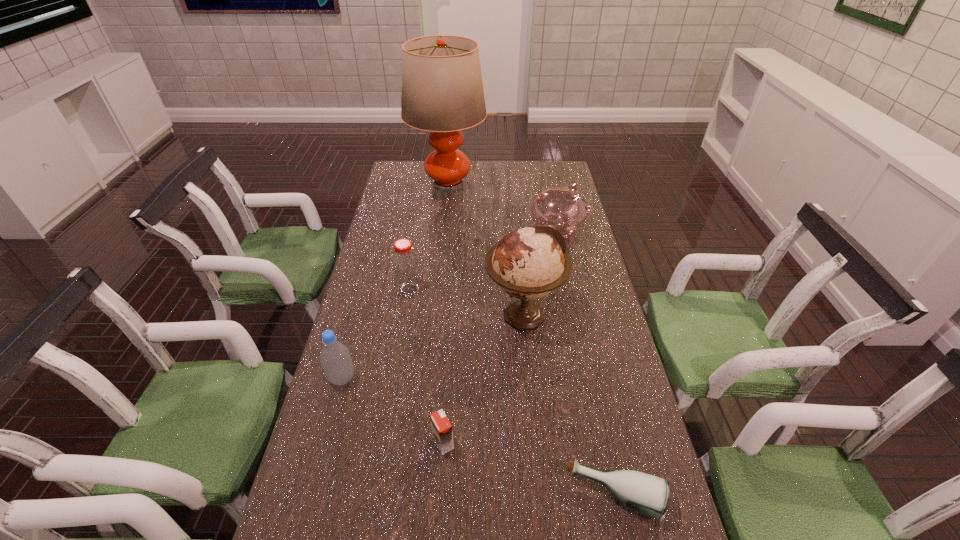
This screenshot has width=960, height=540. What are the coordinates of `lamp situated at the left edge` in the screenshot? It's located at (442, 90).

Locate an element on the screen. globe situated at the right edge is located at coordinates (528, 263).

Where is `piggy bank that is at the right edge`? Image resolution: width=960 pixels, height=540 pixels. piggy bank that is at the right edge is located at coordinates (563, 208).

Locate an element on the screen. The width and height of the screenshot is (960, 540). bottle positioned at the right edge is located at coordinates (648, 494).

Locate an element on the screen. object at the far left corner is located at coordinates (442, 90).

In the image, there is a desktop. Identify the location of vacant region at the left edge. coord(377,422).

Image resolution: width=960 pixels, height=540 pixels. In order to click on free region at the right edge in this screenshot , I will do `click(639, 444)`.

In order to click on vacant space at the far left corner of the desktop in this screenshot , I will do `click(393, 171)`.

The width and height of the screenshot is (960, 540). Identify the location of vacant space at the far right corner of the desktop. (533, 167).

Find the location of a particular element. Image resolution: width=960 pixels, height=540 pixels. empty space that is in between the globe and the shortest object is located at coordinates (569, 406).